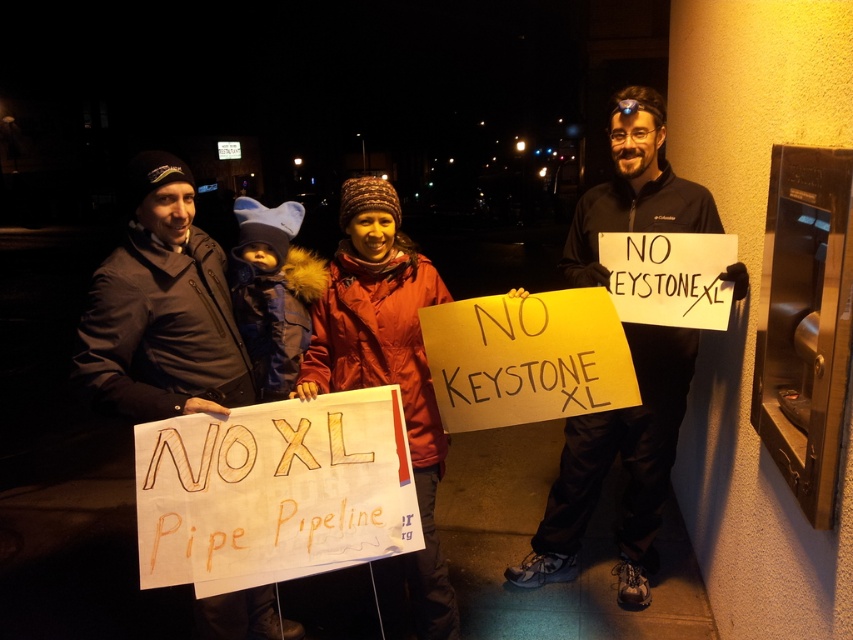
You are a photographer trying to capture a photo of the protesters. You want to ensure both the matte black jacket at right and the dark gray jacket at center are visible in your shot. Based on their positions, which jacket should you focus on first to frame them properly?

The matte black jacket at right is to the right of the dark gray jacket at center. To frame them properly, focus on the dark gray jacket at center first, then adjust to include the matte black jacket at right.

You are a photographer trying to capture a group photo of the protesters. You notice the matte black jacket at right and the dark gray jacket at center. Which jacket should you focus on to ensure the entire group is in frame, considering their positions and sizes?

The matte black jacket at right might be wider than dark gray jacket at center, so focusing on the matte black jacket at right would ensure the entire group is captured in the frame due to its potential larger width.